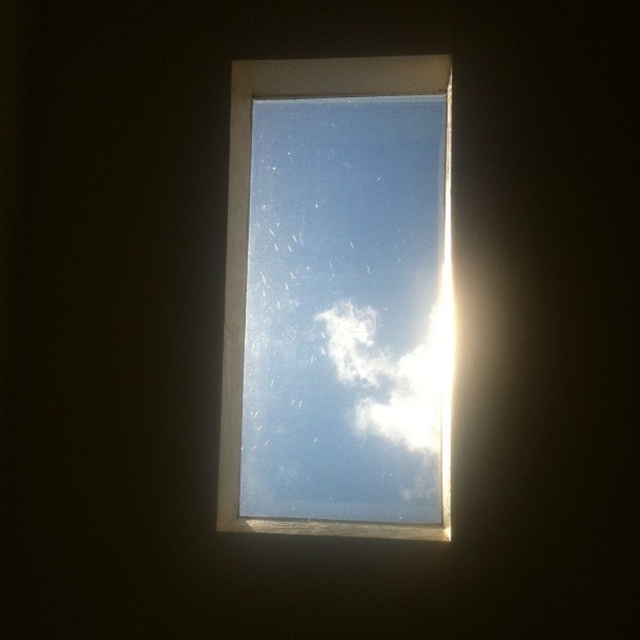
You are an astronomer observing the sky through the transparent glass window at upper center. You notice the white fluffy cloud at upper center. Can you determine if the cloud is closer to you or farther away based on their sizes?

The transparent glass window at upper center is taller than the white fluffy cloud at upper center. Since the window is part of the frame and the cloud is outside, the cloud must be farther away because it appears smaller in comparison.

You are an interior designer assessing the lighting in a room. You notice the transparent glass window at upper center and the white fluffy cloud at upper center. Which object occupies more horizontal space in the frame?

The transparent glass window at upper center has a greater width than the white fluffy cloud at upper center, so it occupies more horizontal space in the frame.

You are an astronaut floating in space near the International Space Station. You have a 6.5 inch wide tool that you need to place between the transparent glass window at upper center and the white fluffy cloud at upper center. Can you fit the tool in the space between them?

The transparent glass window at upper center is 6.61 inches from the white fluffy cloud at upper center. Since the tool is 6.5 inches wide, it can fit between them as the distance is slightly larger than the tool.